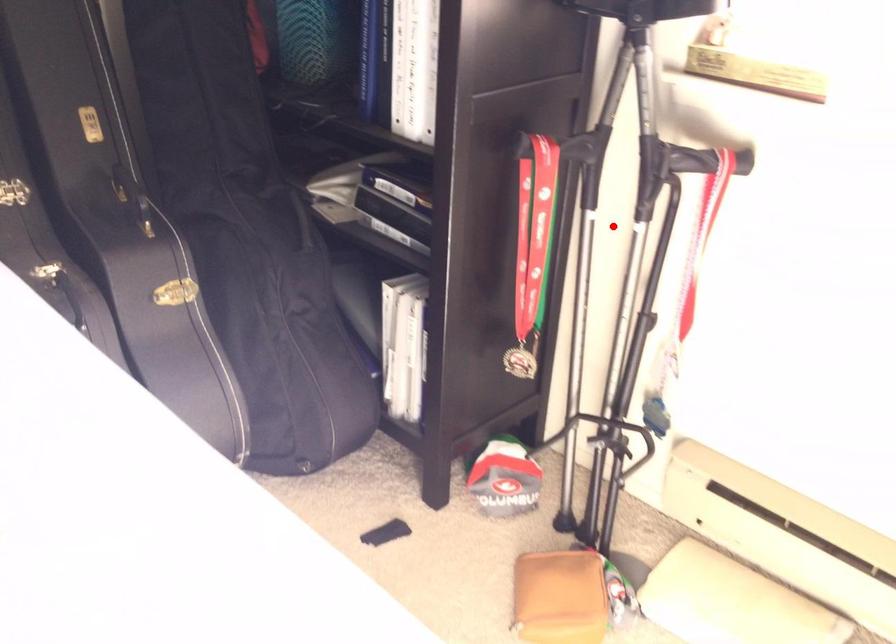
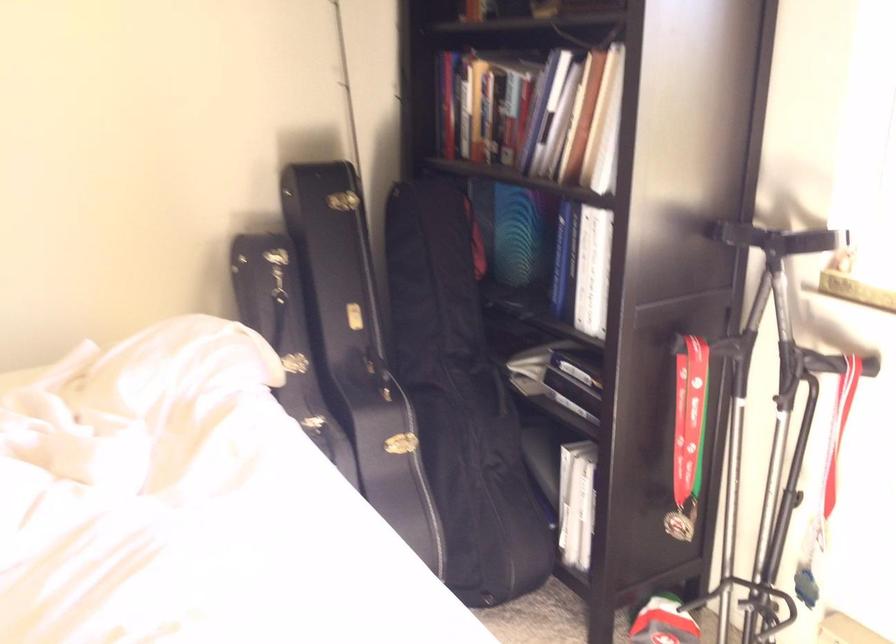
Locate, in the second image, the point that corresponds to the highlighted location in the first image.

(764, 413)